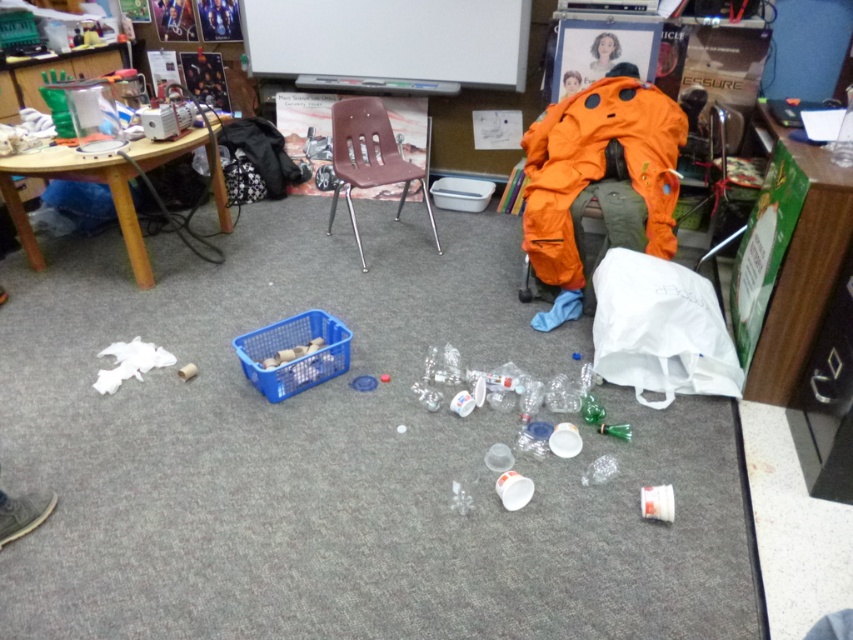
Between brown plastic chair at center and orange fabric at center, which one is positioned lower?

brown plastic chair at center is below.

How much distance is there between brown plastic chair at center and orange fabric at center?

A distance of 1.03 meters exists between brown plastic chair at center and orange fabric at center.

Which is behind, point (352, 220) or point (566, 72)?

Point (566, 72)

I want to click on brown plastic chair at center, so click(x=370, y=157).

Between blonde hair at upper center and orange fabric at center, which one has more height?

Standing taller between the two is blonde hair at upper center.

Who is shorter, blonde hair at upper center or orange fabric at center?

orange fabric at center

What do you see at coordinates (602, 54) in the screenshot?
I see `blonde hair at upper center` at bounding box center [602, 54].

Find the location of `blonde hair at upper center`. blonde hair at upper center is located at coordinates (602, 54).

Does brown plastic chair at center have a larger size compared to blonde hair at upper center?

Yes.

Find the location of a particular element. The image size is (853, 640). brown plastic chair at center is located at coordinates (370, 157).